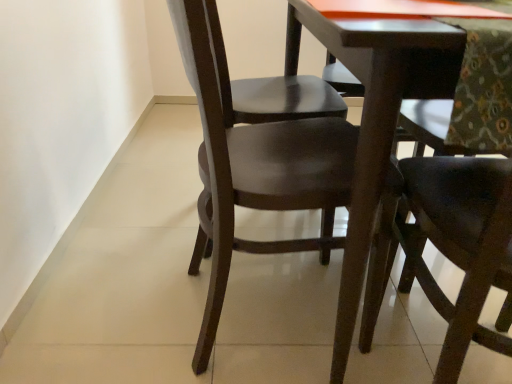
Question: Is glossy dark wood chair at center, the 1th chair when ordered from left to right, thinner than dark wood chair at center, positioned as the first chair in right-to-left order?

Choices:
 (A) no
 (B) yes

Answer: (A)

Question: Is glossy dark wood chair at center, marked as the 2th chair in a right-to-left arrangement, not close to dark wood chair at center, which ranks as the 2th chair in left-to-right order?

Choices:
 (A) yes
 (B) no

Answer: (B)

Question: Is glossy dark wood chair at center, the 1th chair when ordered from left to right, to the right of dark wood chair at center, which ranks as the 2th chair in left-to-right order, from the viewer's perspective?

Choices:
 (A) yes
 (B) no

Answer: (B)

Question: Is glossy dark wood chair at center, marked as the 2th chair in a right-to-left arrangement, facing away from dark wood chair at center, positioned as the first chair in right-to-left order?

Choices:
 (A) yes
 (B) no

Answer: (B)

Question: Is glossy dark wood chair at center, the 1th chair when ordered from left to right, to the left of dark wood chair at center, positioned as the first chair in right-to-left order, from the viewer's perspective?

Choices:
 (A) yes
 (B) no

Answer: (A)

Question: Is glossy dark wood chair at center, the 1th chair when ordered from left to right, surrounding dark wood chair at center, which ranks as the 2th chair in left-to-right order?

Choices:
 (A) no
 (B) yes

Answer: (A)

Question: From the image's perspective, does dark wood chair at center, positioned as the first chair in right-to-left order, appear higher than glossy dark wood chair at center, the 1th chair when ordered from left to right?

Choices:
 (A) no
 (B) yes

Answer: (A)

Question: Is there a large distance between dark wood chair at center, which ranks as the 2th chair in left-to-right order, and glossy dark wood chair at center, marked as the 2th chair in a right-to-left arrangement?

Choices:
 (A) yes
 (B) no

Answer: (B)

Question: Is dark wood chair at center, positioned as the first chair in right-to-left order, not within glossy dark wood chair at center, marked as the 2th chair in a right-to-left arrangement?

Choices:
 (A) no
 (B) yes

Answer: (B)

Question: Is dark wood chair at center, positioned as the first chair in right-to-left order, touching glossy dark wood chair at center, marked as the 2th chair in a right-to-left arrangement?

Choices:
 (A) yes
 (B) no

Answer: (B)

Question: Is glossy dark wood chair at center, marked as the 2th chair in a right-to-left arrangement, a part of dark wood chair at center, positioned as the first chair in right-to-left order?

Choices:
 (A) yes
 (B) no

Answer: (B)

Question: From the image's perspective, is dark wood chair at center, which ranks as the 2th chair in left-to-right order, beneath glossy dark wood chair at center, the 1th chair when ordered from left to right?

Choices:
 (A) no
 (B) yes

Answer: (B)

Question: Looking at their shapes, would you say dark wood chair at center, positioned as the first chair in right-to-left order, is wider or thinner than glossy dark wood chair at center, marked as the 2th chair in a right-to-left arrangement?

Choices:
 (A) thin
 (B) wide

Answer: (A)